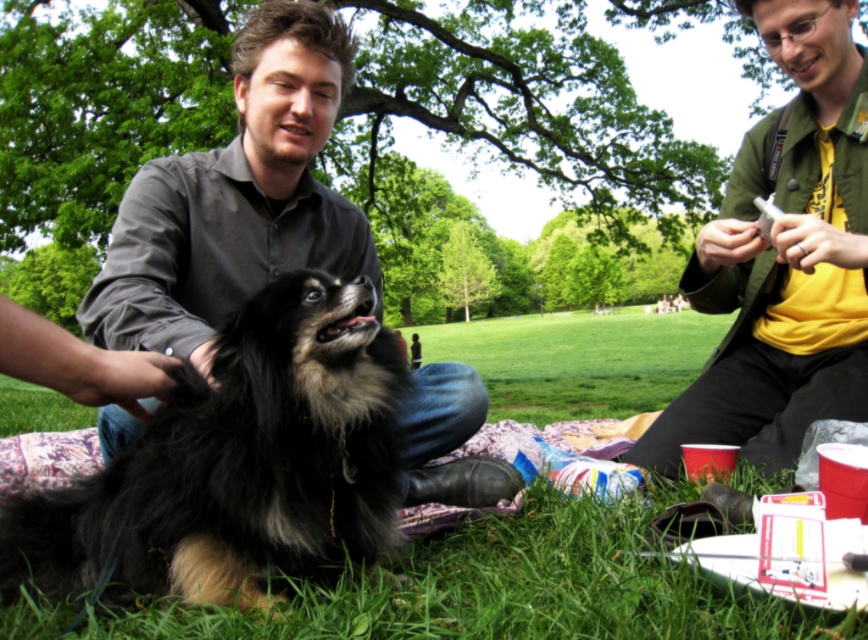
You are standing at the point marked as point (235, 198) in the park scene. What object is located exactly at that point?

The dark gray shirt at center is located exactly at point (235, 198).

In the scene shown: You are a photographer trying to capture a group photo of the dark gray shirt at center and the yellow cotton shirt at upper right. If you want to ensure both shirts are fully visible in the frame, which shirt should you focus on first to adjust the camera angle?

The dark gray shirt at center is shorter than the yellow cotton shirt at upper right, so you should focus on adjusting the camera angle for the dark gray shirt at center first to ensure it is fully visible in the frame.